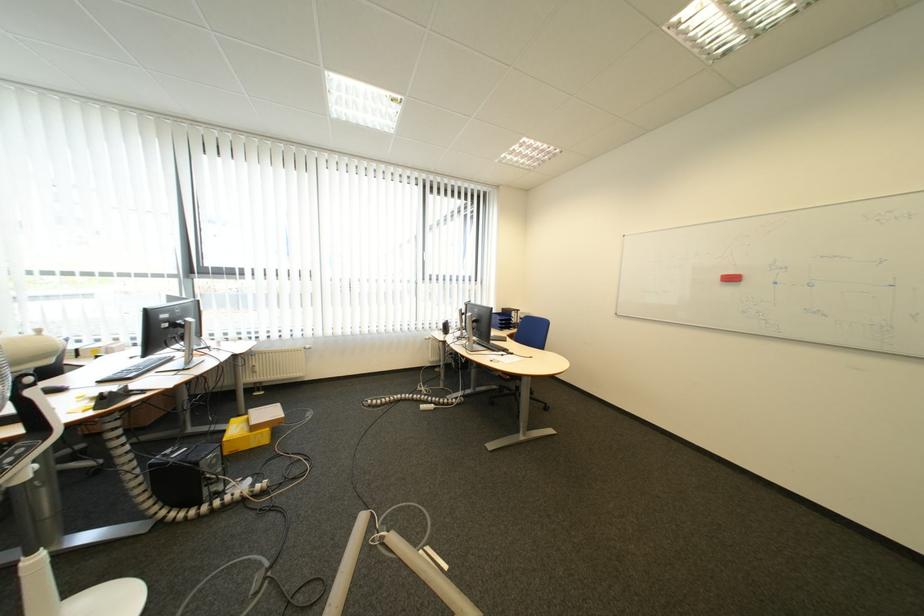
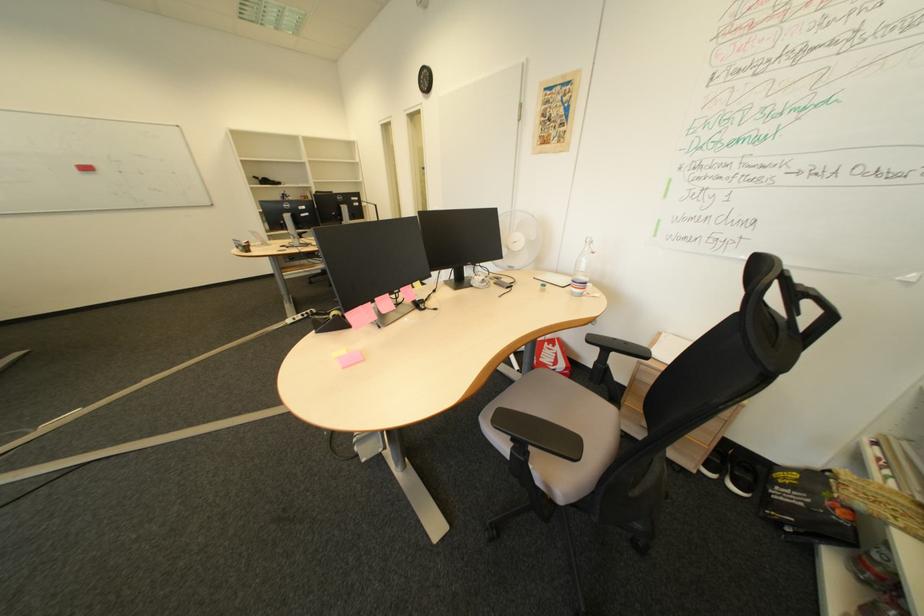
Locate, in the second image, the point that corresponds to point 788,285 in the first image.

(135, 174)